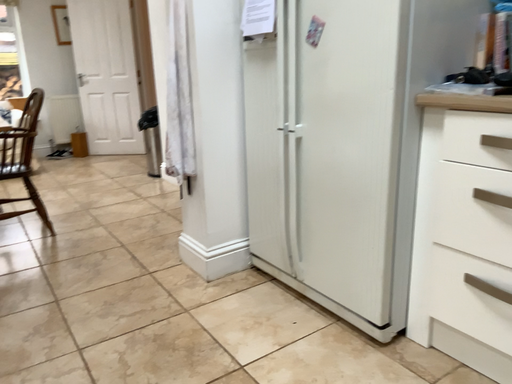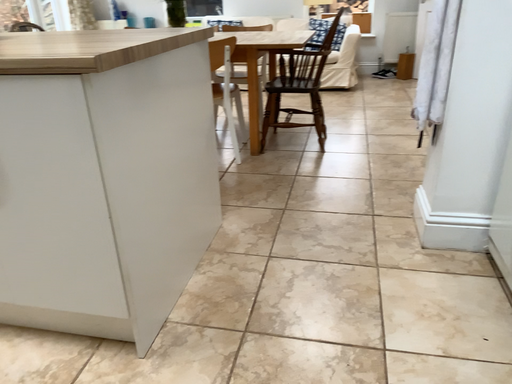
Question: How did the camera likely rotate when shooting the video?

Choices:
 (A) rotated left
 (B) rotated right

Answer: (A)